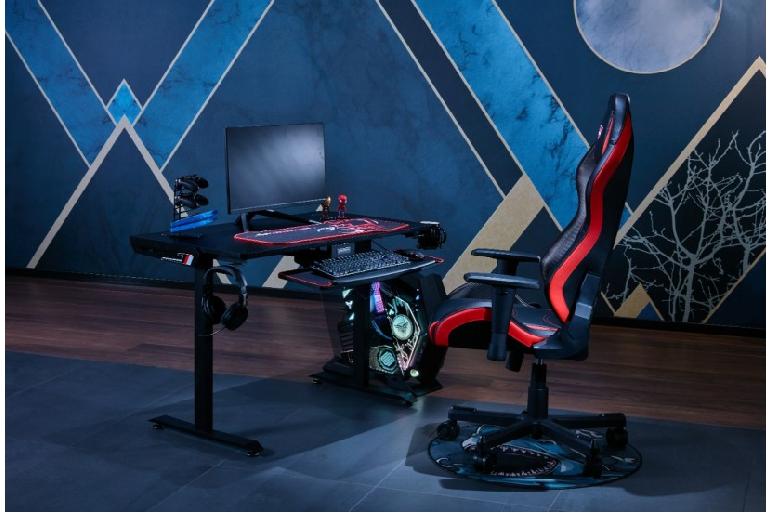
Find the location of a particular element. This screenshot has height=512, width=768. spider man action figure is located at coordinates (343, 204).